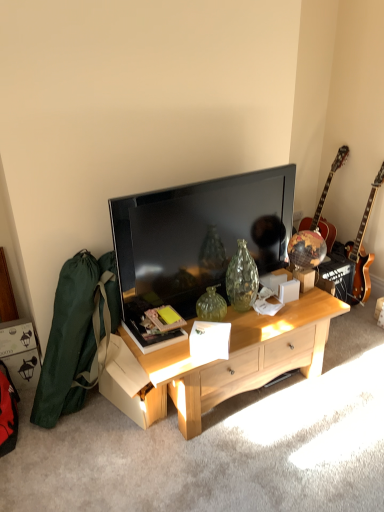
Question: In terms of width, does light wood cabinet at center look wider or thinner when compared to wooden acoustic guitar at right, which is counted as the 1th guitar, starting from the left?

Choices:
 (A) wide
 (B) thin

Answer: (A)

Question: Is light wood cabinet at center to the left or to the right of wooden acoustic guitar at right, the 2th guitar in the right-to-left sequence, in the image?

Choices:
 (A) left
 (B) right

Answer: (A)

Question: Estimate the real-world distances between objects in this image. Which object is closer to the glossy wood guitar at right, the second guitar positioned from the left?

Choices:
 (A) light wood cabinet at center
 (B) wooden acoustic guitar at right, the 2th guitar in the right-to-left sequence
 (C) matte black tv at center

Answer: (B)

Question: Which object is the closest to the glossy wood guitar at right, the first guitar positioned from the right?

Choices:
 (A) matte black tv at center
 (B) wooden acoustic guitar at right, which is counted as the 1th guitar, starting from the left
 (C) light wood cabinet at center

Answer: (B)